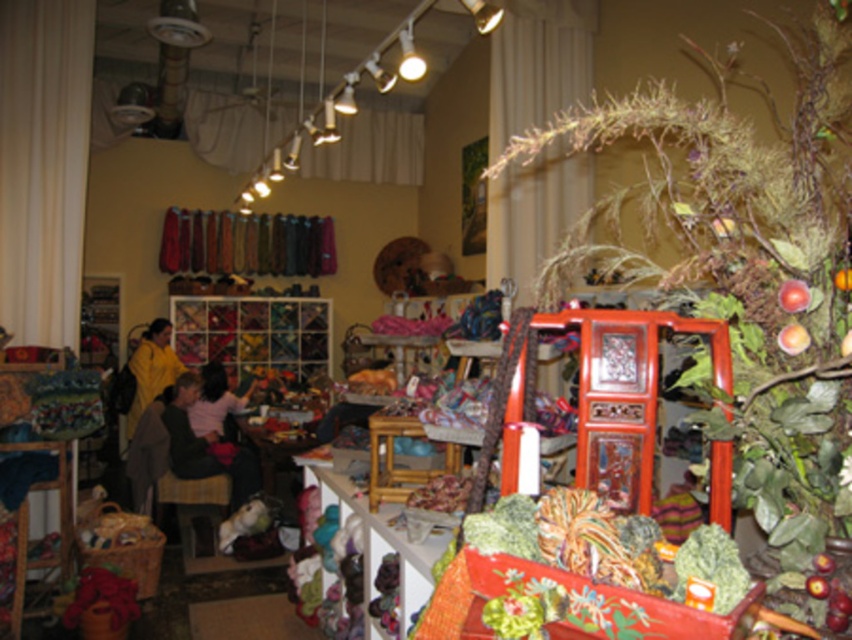
Does dark gray sweater at center appear on the right side of yellow fabric at left?

Indeed, dark gray sweater at center is positioned on the right side of yellow fabric at left.

Does point (213, 438) come behind point (137, 397)?

No.

In order to click on dark gray sweater at center in this screenshot , I will do `click(204, 445)`.

Is dark gray sweater at center further to camera compared to bamboo stool at center?

Yes.

Is dark gray sweater at center taller than bamboo stool at center?

Correct, dark gray sweater at center is much taller as bamboo stool at center.

Who is more distant from viewer, (173, 419) or (377, 435)?

The point (173, 419) is behind.

Locate an element on the screen. The width and height of the screenshot is (852, 640). dark gray sweater at center is located at coordinates (204, 445).

Who is shorter, bamboo stool at center or matte yellow sweater at center?

With less height is bamboo stool at center.

Is point (377, 429) more distant than point (223, 387)?

No, it is not.

Locate an element on the screen. bamboo stool at center is located at coordinates (394, 458).

Locate an element on the screen. bamboo stool at center is located at coordinates (394, 458).